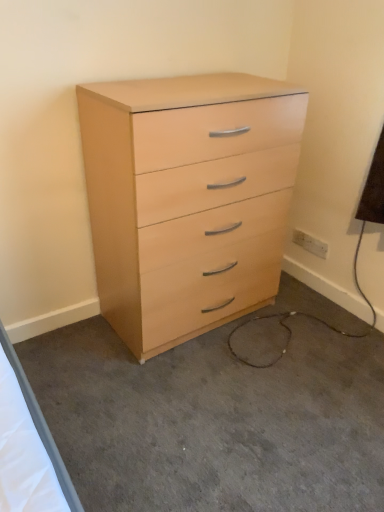
You are a GUI agent. You are given a task and a screenshot of the screen. Output one action in this format:
    pyautogui.click(x=<x>, y=<y>)
    Task: Click on the free location above light wood/finish chest of drawers at center (from a real-world perspective)
    Image resolution: width=384 pixels, height=512 pixels.
    Given the screenshot: What is the action you would take?
    pyautogui.click(x=201, y=84)